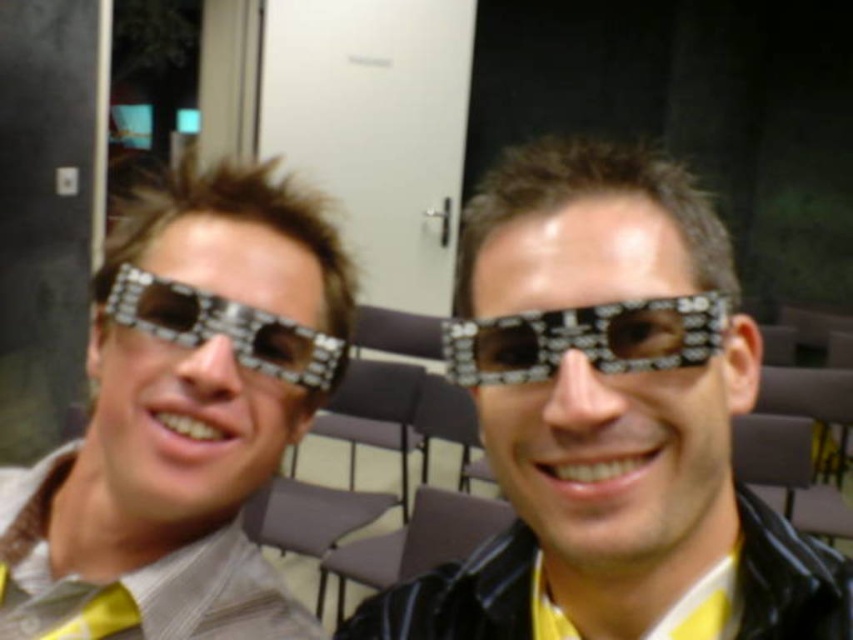
Question: Which of these objects is positioned closest to the metallic reflective sunglasses at center?

Choices:
 (A) black plastic goggles at left
 (B) yellow fabric tie at lower left

Answer: (A)

Question: Is matte black sunglasses at center below metallic reflective sunglasses at center?

Choices:
 (A) yes
 (B) no

Answer: (A)

Question: Considering the relative positions of black plastic goggles at left and yellow fabric tie at lower left in the image provided, where is black plastic goggles at left located with respect to yellow fabric tie at lower left?

Choices:
 (A) left
 (B) right

Answer: (B)

Question: Which object appears closest to the camera in this image?

Choices:
 (A) matte black sunglasses at center
 (B) yellow fabric tie at lower left

Answer: (A)

Question: Does matte black sunglasses at left appear on the left side of yellow fabric tie at lower left?

Choices:
 (A) no
 (B) yes

Answer: (A)

Question: Estimate the real-world distances between objects in this image. Which object is farther from the yellow fabric tie at lower left?

Choices:
 (A) black plastic goggles at left
 (B) matte black sunglasses at center
 (C) metallic reflective sunglasses at center
 (D) matte black sunglasses at left

Answer: (C)